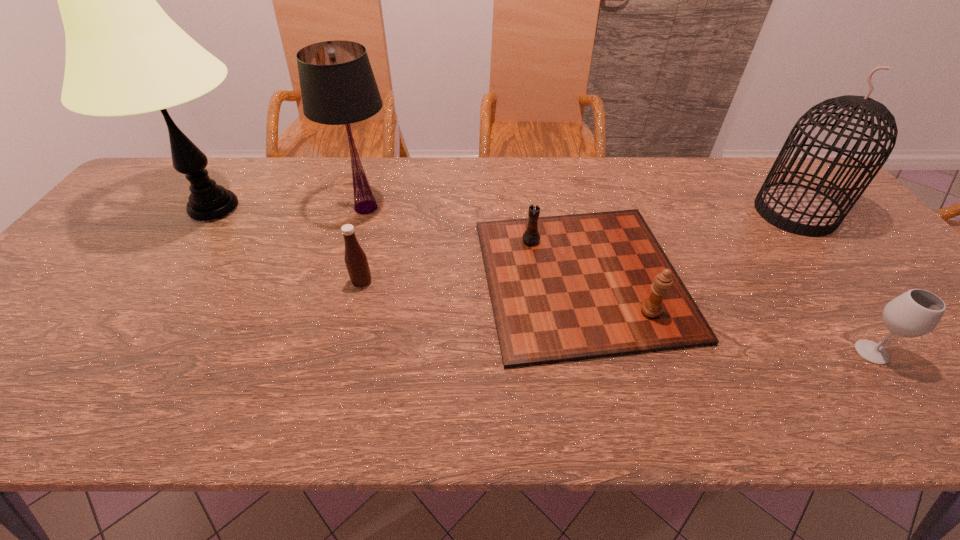
Locate an element on the screen. This screenshot has width=960, height=540. vacant space at the far edge is located at coordinates (324, 199).

What are the coordinates of `free space at the near edge` in the screenshot? It's located at (242, 400).

At what (x,y) coordinates should I click in order to perform the action: click on vacant region at the left edge of the desktop. Please return your answer as a coordinate pair (x, y). The height and width of the screenshot is (540, 960). Looking at the image, I should click on (113, 224).

Locate an element on the screen. vacant position at the right edge of the desktop is located at coordinates tap(861, 266).

Locate an element on the screen. This screenshot has width=960, height=540. vacant area that lies between the gameboard and the tallest object is located at coordinates (397, 243).

In order to click on free space between the birdcage and the fourth object from left to right in this screenshot , I will do `click(688, 245)`.

This screenshot has width=960, height=540. Identify the location of blank region between the wineglass and the birdcage. (833, 282).

Image resolution: width=960 pixels, height=540 pixels. Find the location of `free space that is in between the leftmost object and the Tabasco sauce`. free space that is in between the leftmost object and the Tabasco sauce is located at coordinates (288, 245).

You are a GUI agent. You are given a task and a screenshot of the screen. Output one action in this format:
    pyautogui.click(x=<x>, y=<y>)
    Task: Click on the free spot between the lampshade and the lamp
    Image resolution: width=960 pixels, height=540 pixels.
    Given the screenshot: What is the action you would take?
    pyautogui.click(x=290, y=208)

You are a GUI agent. You are given a task and a screenshot of the screen. Output one action in this format:
    pyautogui.click(x=<x>, y=<y>)
    Task: Click on the free spot between the birdcage and the third object from right to left
    
    Given the screenshot: What is the action you would take?
    pyautogui.click(x=688, y=245)